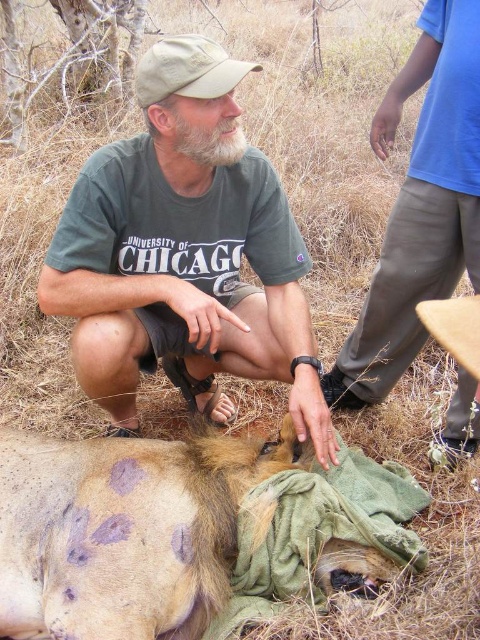
You are a wildlife photographer who needs to place a camera at the origin point. The camera has a lens with a 120 degree field of view. The camera is pointing towards the direction of the blue cotton shirt at upper right. Will the lion lying on the ground and the man crouched beside it be visible in the photo?

The blue cotton shirt at upper right is located at point (420,205). Since the camera is pointing towards it with a 120 degree field of view, the lion and the man beside it would be within the field of view and visible in the photo.

You are a wildlife researcher observing the lion and the man in the scene. You have a blue cotton shirt at upper right that you want to use to cover the lion. Can you reach the shirt from your current position without moving?

The distance between you and the blue cotton shirt at upper right is 5.73 feet. Since this distance is greater than the average human arm length of around 2.5 feet, you cannot reach the shirt without moving closer.